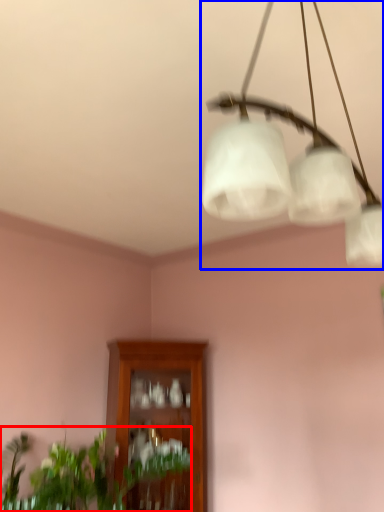
Question: Which of the following is the closest to the observer, houseplant (highlighted by a red box) or lamp (highlighted by a blue box)?

Choices:
 (A) houseplant
 (B) lamp

Answer: (B)